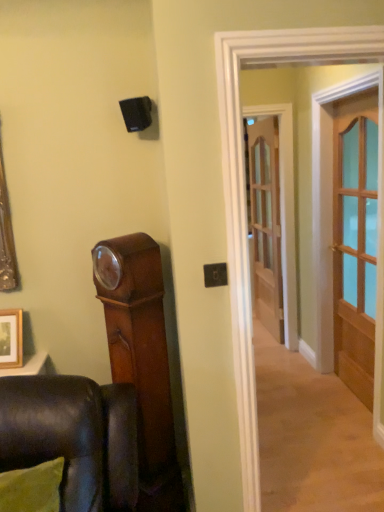
Question: Is light brown wooden door at right, which is the first door in front-to-back order, taller than clear glass door at center, which is counted as the second door, starting from the front?

Choices:
 (A) no
 (B) yes

Answer: (B)

Question: Considering the relative positions of light brown wooden door at right, positioned as the second door in back-to-front order, and clear glass door at center, which is counted as the second door, starting from the front, in the image provided, is light brown wooden door at right, positioned as the second door in back-to-front order, behind clear glass door at center, which is counted as the second door, starting from the front,?

Choices:
 (A) yes
 (B) no

Answer: (B)

Question: Is the position of light brown wooden door at right, which is counted as the second door, starting from the left, less distant than that of clear glass door at center, the second door when ordered from right to left?

Choices:
 (A) no
 (B) yes

Answer: (B)

Question: Considering the relative sizes of light brown wooden door at right, positioned as the second door in back-to-front order, and clear glass door at center, the second door when ordered from right to left, in the image provided, is light brown wooden door at right, positioned as the second door in back-to-front order, wider than clear glass door at center, the second door when ordered from right to left,?

Choices:
 (A) yes
 (B) no

Answer: (A)

Question: Is light brown wooden door at right, which appears as the first door when viewed from the right, aimed at clear glass door at center, the 1th door when ordered from left to right?

Choices:
 (A) yes
 (B) no

Answer: (B)

Question: Is light brown wooden door at right, which is the first door in front-to-back order, at the right side of clear glass door at center, which is counted as the second door, starting from the front?

Choices:
 (A) yes
 (B) no

Answer: (A)

Question: Can you confirm if wooden picture frame at lower left is shorter than clear glass door at center, which is counted as the first door, starting from the back?

Choices:
 (A) no
 (B) yes

Answer: (B)

Question: Does wooden picture frame at lower left come in front of clear glass door at center, the 1th door when ordered from left to right?

Choices:
 (A) no
 (B) yes

Answer: (B)

Question: Is wooden picture frame at lower left directly adjacent to clear glass door at center, the 1th door when ordered from left to right?

Choices:
 (A) yes
 (B) no

Answer: (B)

Question: Considering the relative sizes of wooden picture frame at lower left and clear glass door at center, which is counted as the first door, starting from the back, in the image provided, is wooden picture frame at lower left taller than clear glass door at center, which is counted as the first door, starting from the back,?

Choices:
 (A) no
 (B) yes

Answer: (A)

Question: From a real-world perspective, is wooden picture frame at lower left beneath clear glass door at center, which is counted as the first door, starting from the back?

Choices:
 (A) yes
 (B) no

Answer: (B)

Question: Does wooden picture frame at lower left have a greater width compared to clear glass door at center, the 1th door when ordered from left to right?

Choices:
 (A) yes
 (B) no

Answer: (A)

Question: Is clear glass door at center, which is counted as the second door, starting from the front, not inside light brown wooden door at right, which is the first door in front-to-back order?

Choices:
 (A) no
 (B) yes

Answer: (B)